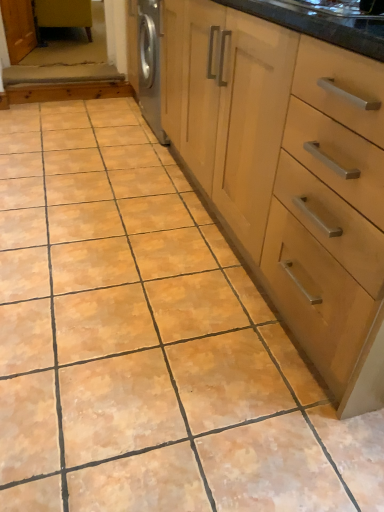
The height and width of the screenshot is (512, 384). What do you see at coordinates (289, 175) in the screenshot? I see `wooden cabinet at center` at bounding box center [289, 175].

The height and width of the screenshot is (512, 384). In order to click on wooden cabinet at center in this screenshot , I will do `click(289, 175)`.

Locate an element on the screen. wooden cabinet at center is located at coordinates (289, 175).